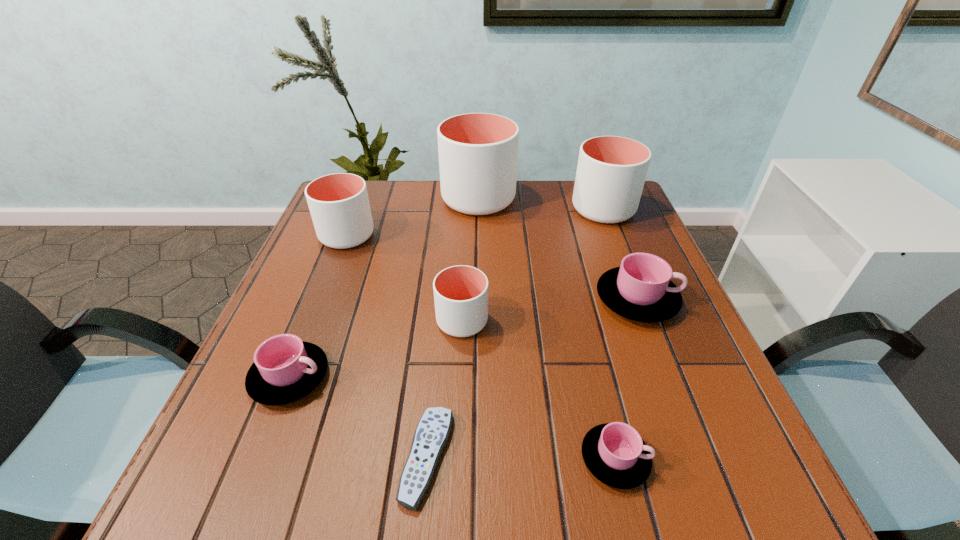
The height and width of the screenshot is (540, 960). In order to click on free location that satisfies the following two spatial constraints: 1. on the side with the handle of the second farthest pink cup; 2. on the left side of the shortest object in this screenshot , I will do `click(258, 457)`.